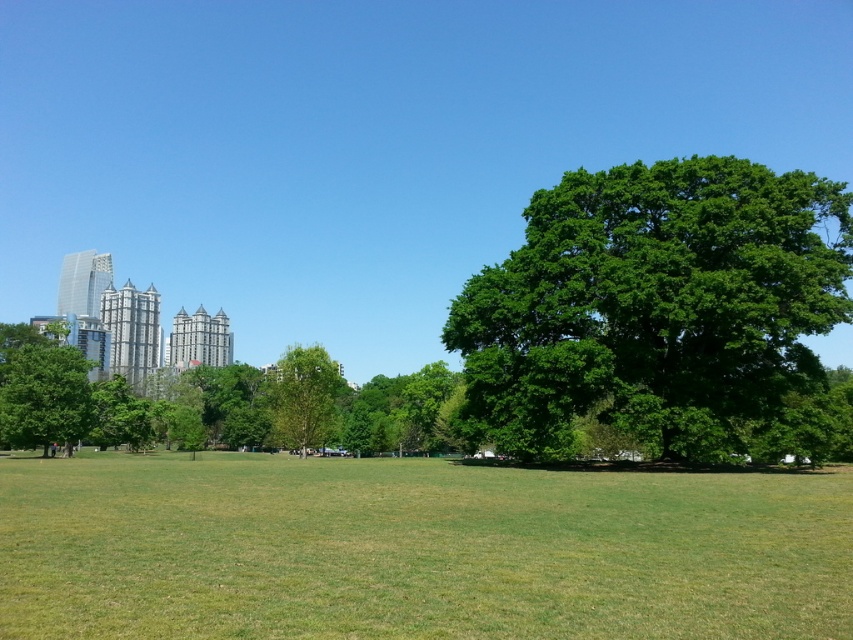
Question: Which point appears farthest from the camera in this image?

Choices:
 (A) (569, 636)
 (B) (325, 353)
 (C) (546, 246)

Answer: (B)

Question: Does green leafy tree at left have a larger size compared to green leafy tree at center?

Choices:
 (A) yes
 (B) no

Answer: (B)

Question: In this image, where is green leafy tree at left located relative to green leafy tree at center?

Choices:
 (A) right
 (B) left

Answer: (B)

Question: Which object is positioned closest to the green leafy tree at left?

Choices:
 (A) green grass at center
 (B) green leafy tree at center

Answer: (B)

Question: Can you confirm if green grass at center is bigger than green leafy tree at right?

Choices:
 (A) yes
 (B) no

Answer: (B)

Question: Which point is farther to the camera?

Choices:
 (A) green leafy tree at left
 (B) green grass at center

Answer: (A)